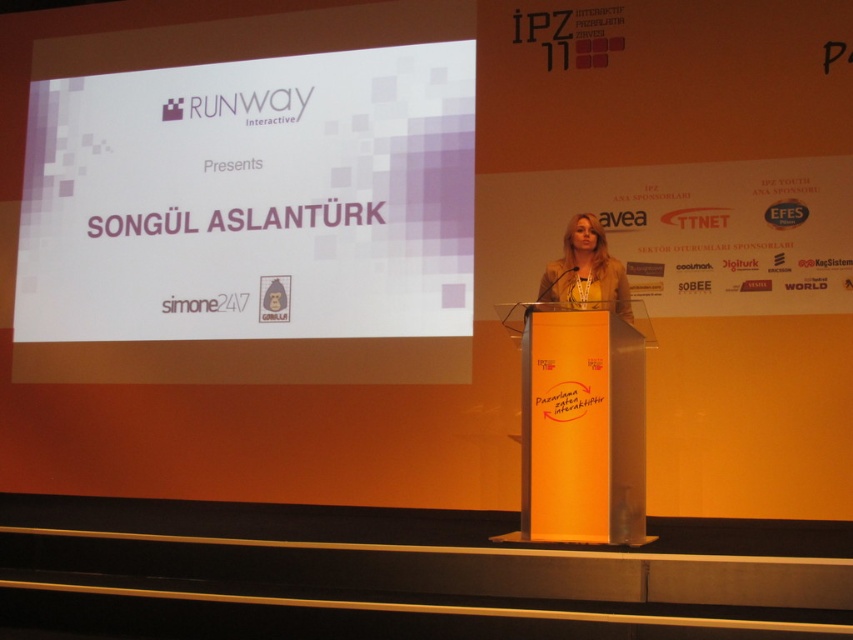
Between white matte screen at upper center and orange glossy podium at center, which one is positioned lower?

orange glossy podium at center is below.

Can you confirm if white matte screen at upper center is positioned above orange glossy podium at center?

Yes, white matte screen at upper center is above orange glossy podium at center.

This screenshot has width=853, height=640. I want to click on white matte screen at upper center, so click(251, 198).

I want to click on white matte screen at upper center, so click(x=251, y=198).

Does orange glossy podium at center have a larger size compared to matte yellow dress at center?

Yes.

Does orange glossy podium at center have a lesser width compared to matte yellow dress at center?

No, orange glossy podium at center is not thinner than matte yellow dress at center.

Which is behind, point (612, 508) or point (585, 212)?

Point (585, 212)

This screenshot has width=853, height=640. I want to click on orange glossy podium at center, so click(581, 429).

Can you confirm if white matte screen at upper center is positioned to the left of matte yellow dress at center?

Correct, you'll find white matte screen at upper center to the left of matte yellow dress at center.

Between white matte screen at upper center and matte yellow dress at center, which one has less height?

With less height is matte yellow dress at center.

What do you see at coordinates (251, 198) in the screenshot?
I see `white matte screen at upper center` at bounding box center [251, 198].

I want to click on white matte screen at upper center, so click(x=251, y=198).